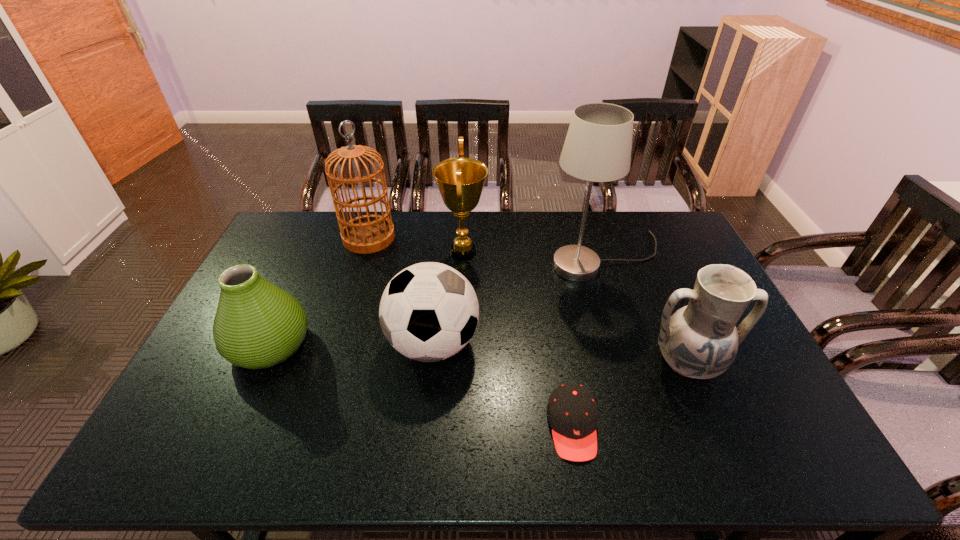
Find the location of a particular element. pitcher situated at the right edge is located at coordinates (x=700, y=340).

Identify the location of object located at the far right corner. The width and height of the screenshot is (960, 540). (597, 148).

Find the location of a particular element. The image size is (960, 540). free space at the far edge of the desktop is located at coordinates (473, 235).

This screenshot has width=960, height=540. Identify the location of vacant space at the near edge of the desktop. (284, 435).

In the image, there is a desktop. At what (x,y) coordinates should I click in order to perform the action: click on vacant space at the left edge. Please return your answer as a coordinate pair (x, y). This screenshot has height=540, width=960. Looking at the image, I should click on (300, 253).

This screenshot has height=540, width=960. What are the coordinates of `vacant space at the right edge` in the screenshot? It's located at coord(664,263).

The image size is (960, 540). I want to click on free location at the near left corner, so click(x=182, y=466).

In the image, there is a desktop. Find the location of `vacant space at the far right corner`. vacant space at the far right corner is located at coordinates (642, 218).

The height and width of the screenshot is (540, 960). Find the location of `vacant area that lies between the vase and the award`. vacant area that lies between the vase and the award is located at coordinates (367, 298).

In order to click on free space between the pitcher and the cap in this screenshot , I will do `click(630, 395)`.